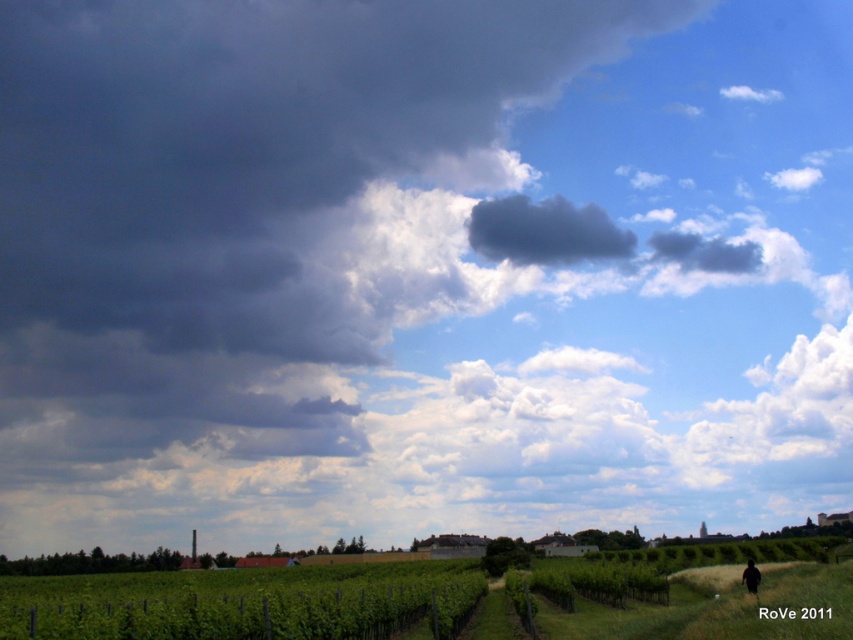
Between dark gray cloud at upper center and dark brown hair at lower right, which one has more height?

dark gray cloud at upper center

Does dark gray cloud at upper center appear on the right side of dark brown hair at lower right?

Correct, you'll find dark gray cloud at upper center to the right of dark brown hair at lower right.

Where is `dark gray cloud at upper center`? The height and width of the screenshot is (640, 853). dark gray cloud at upper center is located at coordinates (544, 230).